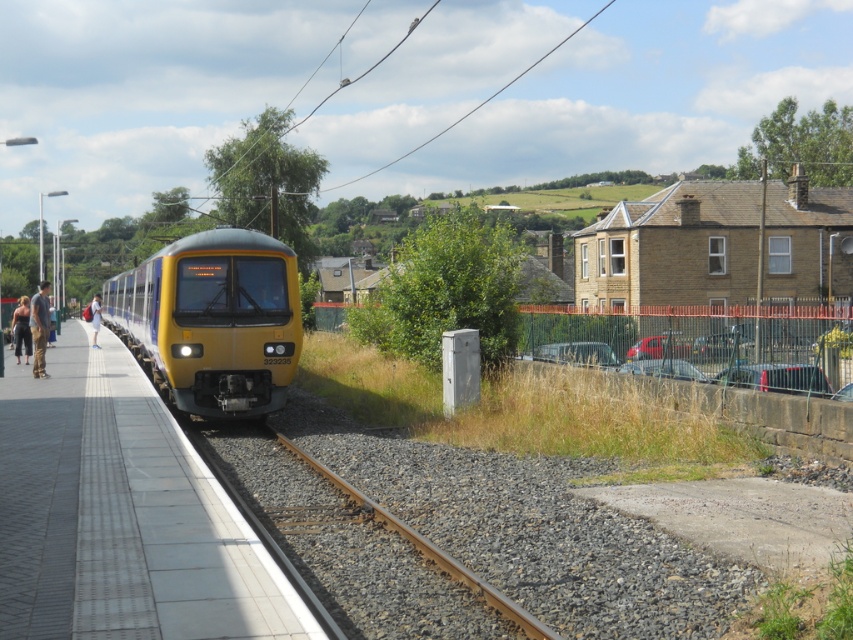
Describe the element at coordinates (213, 321) in the screenshot. I see `yellow matte train at center` at that location.

At what (x,y) coordinates should I click in order to perform the action: click on yellow matte train at center. Please return your answer as a coordinate pair (x, y). Looking at the image, I should click on (213, 321).

The width and height of the screenshot is (853, 640). Find the location of `yellow matte train at center`. yellow matte train at center is located at coordinates (213, 321).

Does smooth concrete platform at center appear on the right side of gravelly metallic track at center?

In fact, smooth concrete platform at center is to the left of gravelly metallic track at center.

Which is more to the right, smooth concrete platform at center or gravelly metallic track at center?

gravelly metallic track at center is more to the right.

Is point (86, 388) more distant than point (451, 564)?

That is True.

You are a GUI agent. You are given a task and a screenshot of the screen. Output one action in this format:
    pyautogui.click(x=<x>, y=<y>)
    Task: Click on the smooth concrete platform at center
    
    Given the screenshot: What is the action you would take?
    pyautogui.click(x=120, y=515)

Is yellow matte train at center taller than gravelly metallic track at center?

Yes.

Does yellow matte train at center appear on the right side of gravelly metallic track at center?

No, yellow matte train at center is not to the right of gravelly metallic track at center.

Image resolution: width=853 pixels, height=640 pixels. Describe the element at coordinates (213, 321) in the screenshot. I see `yellow matte train at center` at that location.

Locate an element on the screen. yellow matte train at center is located at coordinates (213, 321).